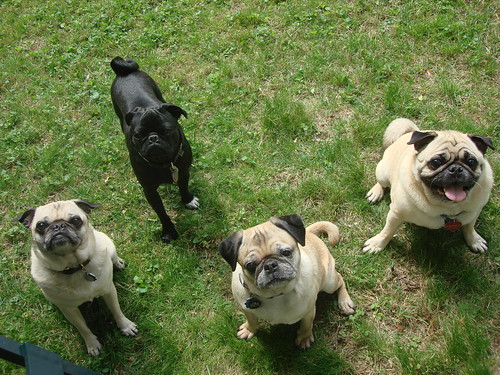
Image resolution: width=500 pixels, height=375 pixels. What are the coordinates of `black frame` in the screenshot? It's located at (54, 365).